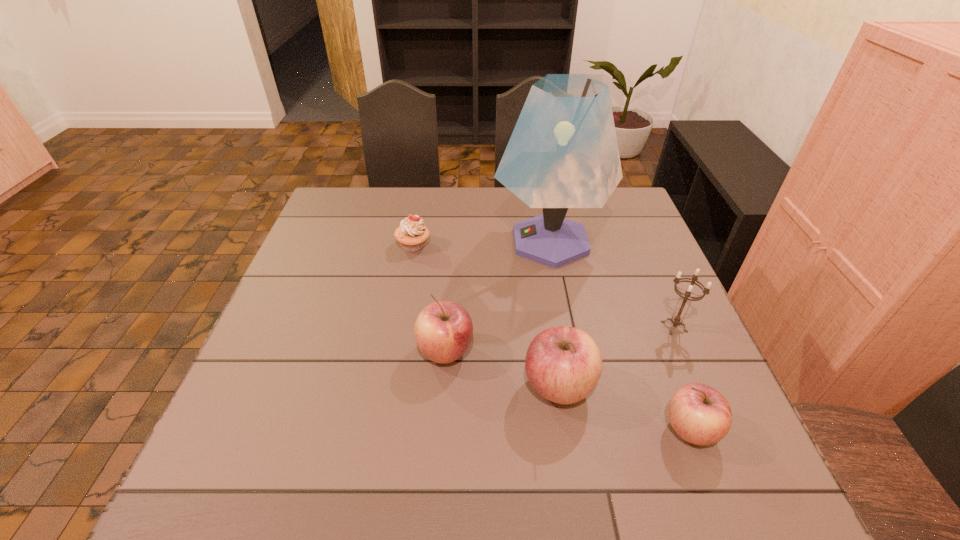
The width and height of the screenshot is (960, 540). In order to click on object that is at the near right corner in this screenshot , I will do `click(699, 414)`.

This screenshot has height=540, width=960. Identify the location of free space at the far edge of the desktop. (421, 198).

Identify the location of vacant area at the near edge. (448, 429).

This screenshot has height=540, width=960. In order to click on vacant space at the left edge of the desktop in this screenshot , I will do `click(348, 265)`.

In the image, there is a desktop. Identify the location of free region at the right edge. This screenshot has width=960, height=540. (653, 282).

Image resolution: width=960 pixels, height=540 pixels. In the image, there is a desktop. What are the coordinates of `blank space at the far left corner` in the screenshot? It's located at (362, 211).

Find the location of a particular element. free space at the far right corner of the desktop is located at coordinates (639, 223).

Find the location of a particular element. free space that is in between the leftmost object and the second shortest apple is located at coordinates [x=429, y=299].

Locate an element on the screen. This screenshot has height=540, width=960. vacant point located between the second tallest apple and the second apple from right to left is located at coordinates (502, 369).

Identify the location of empty space between the leftmost object and the leftmost apple. (429, 299).